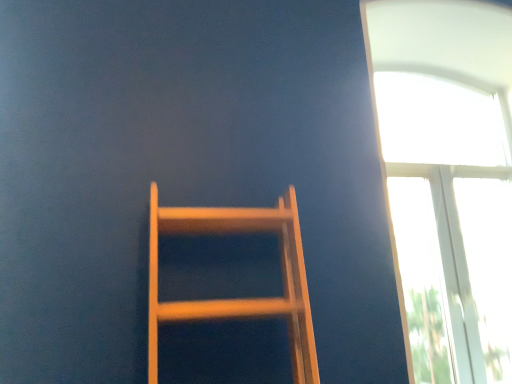
Identify the location of wooden ladder at center. (238, 299).

This screenshot has height=384, width=512. What do you see at coordinates (238, 299) in the screenshot? I see `wooden ladder at center` at bounding box center [238, 299].

Find the location of a particular element. transparent glass window at upper right is located at coordinates (447, 179).

Measure the distance between transparent glass window at upper right and camera.

The depth of transparent glass window at upper right is 1.73 meters.

Measure the distance between point (420,107) and camera.

Result: The depth of point (420,107) is 9.31 feet.

This screenshot has width=512, height=384. Describe the element at coordinates (447, 179) in the screenshot. I see `transparent glass window at upper right` at that location.

Where is `wooden ladder at center`? This screenshot has height=384, width=512. wooden ladder at center is located at coordinates (238, 299).

Which is more to the left, transparent glass window at upper right or wooden ladder at center?

wooden ladder at center.

Considering the positions of objects transparent glass window at upper right and wooden ladder at center in the image provided, who is in front, transparent glass window at upper right or wooden ladder at center?

wooden ladder at center is closer to the camera.

Considering the points (411, 37) and (286, 219), which point is in front, point (411, 37) or point (286, 219)?

The point (286, 219) is closer.

From the image's perspective, which object appears higher, transparent glass window at upper right or wooden ladder at center?

transparent glass window at upper right is shown above in the image.

From a real-world perspective, is transparent glass window at upper right physically located above or below wooden ladder at center?

Clearly, from a real-world perspective, transparent glass window at upper right is above wooden ladder at center.

Between transparent glass window at upper right and wooden ladder at center, which one has smaller width?

transparent glass window at upper right is thinner.

In terms of height, does transparent glass window at upper right look taller or shorter compared to wooden ladder at center?

Considering their sizes, transparent glass window at upper right has more height than wooden ladder at center.

From the picture: Considering the relative sizes of transparent glass window at upper right and wooden ladder at center in the image provided, is transparent glass window at upper right smaller than wooden ladder at center?

Incorrect, transparent glass window at upper right is not smaller in size than wooden ladder at center.

Is transparent glass window at upper right spatially inside wooden ladder at center, or outside of it?

transparent glass window at upper right is spatially situated outside wooden ladder at center.

Would you say transparent glass window at upper right is a long distance from wooden ladder at center?

transparent glass window at upper right is far away from wooden ladder at center.

Does transparent glass window at upper right turn towards wooden ladder at center?

No, transparent glass window at upper right is not turned towards wooden ladder at center.

How different are the orientations of transparent glass window at upper right and wooden ladder at center in degrees?

4.54e-05 degrees.

How much distance is there between transparent glass window at upper right and wooden ladder at center?

transparent glass window at upper right and wooden ladder at center are 1.18 meters apart from each other.

The image size is (512, 384). I want to click on window above the wooden ladder at center (from a real-world perspective), so click(x=447, y=179).

Which object is positioned more to the left, wooden ladder at center or transparent glass window at upper right?

Positioned to the left is wooden ladder at center.

In the image, is wooden ladder at center positioned in front of or behind transparent glass window at upper right?

wooden ladder at center is in front of transparent glass window at upper right.

Which is behind, point (155, 188) or point (434, 376)?

The point (434, 376) is more distant.

From the image's perspective, is wooden ladder at center located beneath transparent glass window at upper right?

Indeed, from the image's perspective, wooden ladder at center is shown beneath transparent glass window at upper right.

From a real-world perspective, between wooden ladder at center and transparent glass window at upper right, who is vertically lower?

wooden ladder at center is physically lower.

Considering the sizes of objects wooden ladder at center and transparent glass window at upper right in the image provided, who is wider, wooden ladder at center or transparent glass window at upper right?

With larger width is wooden ladder at center.

In terms of height, does wooden ladder at center look taller or shorter compared to transparent glass window at upper right?

In the image, wooden ladder at center appears to be shorter than transparent glass window at upper right.

Can you confirm if wooden ladder at center is smaller than transparent glass window at upper right?

Yes.

Is wooden ladder at center completely or partially outside of transparent glass window at upper right?

That's correct, wooden ladder at center is outside of transparent glass window at upper right.

Is there a large distance between wooden ladder at center and transparent glass window at upper right?

Yes, wooden ladder at center and transparent glass window at upper right are quite far apart.

From the picture: Does wooden ladder at center turn towards transparent glass window at upper right?

No.

How different are the orientations of wooden ladder at center and transparent glass window at upper right in degrees?

4.54e-05 degrees.

Identify the location of window behind the wooden ladder at center. The width and height of the screenshot is (512, 384). (447, 179).

Identify the location of furniture below the transparent glass window at upper right (from a real-world perspective). (238, 299).

Where is `window that is on the right side of wooden ladder at center`? The width and height of the screenshot is (512, 384). window that is on the right side of wooden ladder at center is located at coordinates (447, 179).